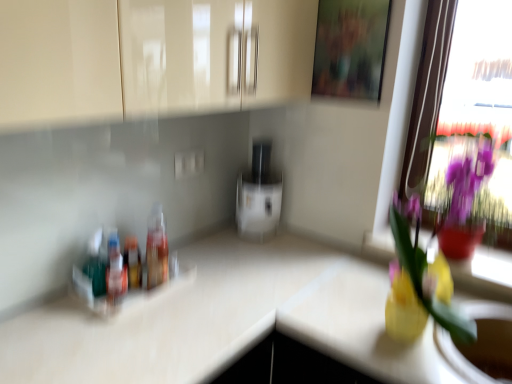
Question: Would you say wooden frame at upper center is inside or outside glossy beige cabinet at upper center?

Choices:
 (A) inside
 (B) outside

Answer: (B)

Question: Would you say wooden frame at upper center is to the left or to the right of glossy beige cabinet at upper center in the picture?

Choices:
 (A) right
 (B) left

Answer: (A)

Question: Which of these objects is positioned farthest from the glossy beige cabinet at upper center?

Choices:
 (A) translucent plastic bottle at center, the third bottle when ordered from left to right
 (B) wooden frame at upper center
 (C) translucent plastic bottles at left, acting as the third bottle starting from the right
 (D) translucent plastic bottles at left, acting as the 2th bottle starting from the left
 (E) white glossy countertop at center

Answer: (D)

Question: Estimate the real-world distances between objects in this image. Which object is farther from the wooden frame at upper center?

Choices:
 (A) white glossy countertop at center
 (B) transparent glass window at upper right
 (C) translucent plastic bottles at left, acting as the 2th bottle starting from the left
 (D) yellow glass vase at right
 (E) translucent plastic bottle at center, positioned as the first bottle in right-to-left order

Answer: (C)